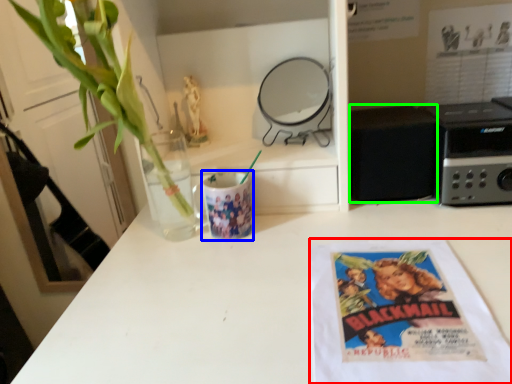
Question: Considering the real-world distances, which object is farthest from paperback book (highlighted by a red box)? mug (highlighted by a blue box) or appliance (highlighted by a green box)?

Choices:
 (A) mug
 (B) appliance

Answer: (A)